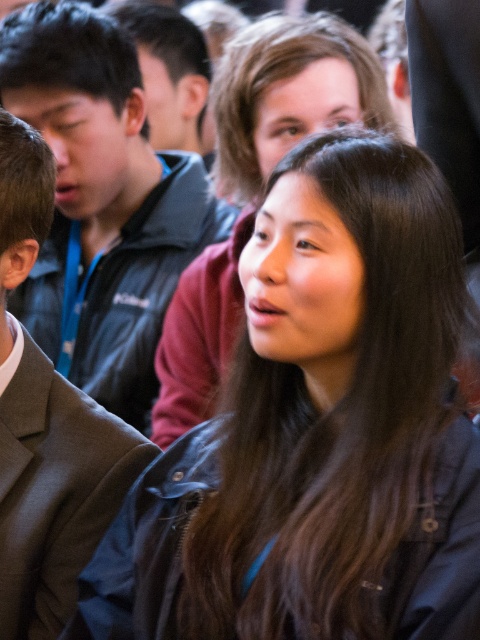
Question: Is black leather jacket at center closer to the viewer compared to dark gray suit at left?

Choices:
 (A) no
 (B) yes

Answer: (B)

Question: Where is matte black jacket at center located in relation to matte black jacket at upper left in the image?

Choices:
 (A) left
 (B) right

Answer: (A)

Question: Among these points, which one is nearest to the camera?

Choices:
 (A) (223, 349)
 (B) (170, 243)

Answer: (A)

Question: Which object is positioned farthest from the dark gray suit at left?

Choices:
 (A) matte black jacket at upper left
 (B) black leather jacket at center
 (C) matte black jacket at center
 (D) smooth black hair at center

Answer: (A)

Question: Does black leather jacket at center appear on the right side of smooth black hair at center?

Choices:
 (A) yes
 (B) no

Answer: (A)

Question: Which object is positioned closest to the matte black jacket at center?

Choices:
 (A) smooth black hair at center
 (B) black leather jacket at center
 (C) matte black jacket at upper left

Answer: (A)